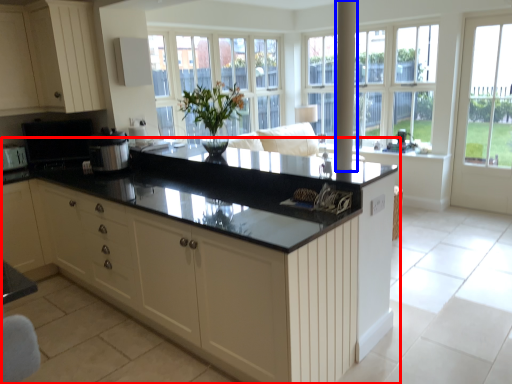
Question: Which object is further to the camera taking this photo, countertop (highlighted by a red box) or pole (highlighted by a blue box)?

Choices:
 (A) countertop
 (B) pole

Answer: (B)